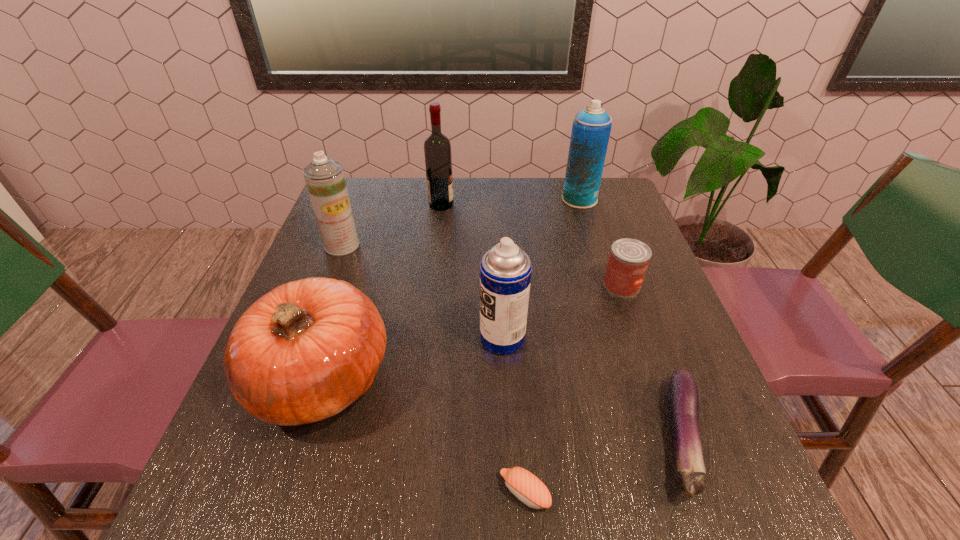
You are a GUI agent. You are given a task and a screenshot of the screen. Output one action in this format:
    pyautogui.click(x=<x>, y=<y>)
    Task: Click on the object that is at the near right corner
    
    Given the screenshot: What is the action you would take?
    pyautogui.click(x=683, y=404)

The image size is (960, 540). Identify the location of vacant space at the far edge of the desktop. (510, 207).

Image resolution: width=960 pixels, height=540 pixels. I want to click on vacant area at the left edge of the desktop, so click(299, 426).

Where is `free space at the right edge of the desktop`? This screenshot has height=540, width=960. free space at the right edge of the desktop is located at coordinates (637, 295).

Locate an element on the screen. free spot at the far left corner of the desktop is located at coordinates (368, 199).

In the image, there is a desktop. Identify the location of free space at the near right corner. (688, 503).

Find the location of `vacant area between the pumpkin and the fourth farthest object`. vacant area between the pumpkin and the fourth farthest object is located at coordinates (471, 332).

Identify the location of free space that is in between the eggplant and the fifth tallest object. (501, 408).

Identify the location of blank region between the can and the nearest aerosol can. (562, 312).

This screenshot has height=540, width=960. Find the location of `free spot between the sushi and the alcohol`. free spot between the sushi and the alcohol is located at coordinates (483, 349).